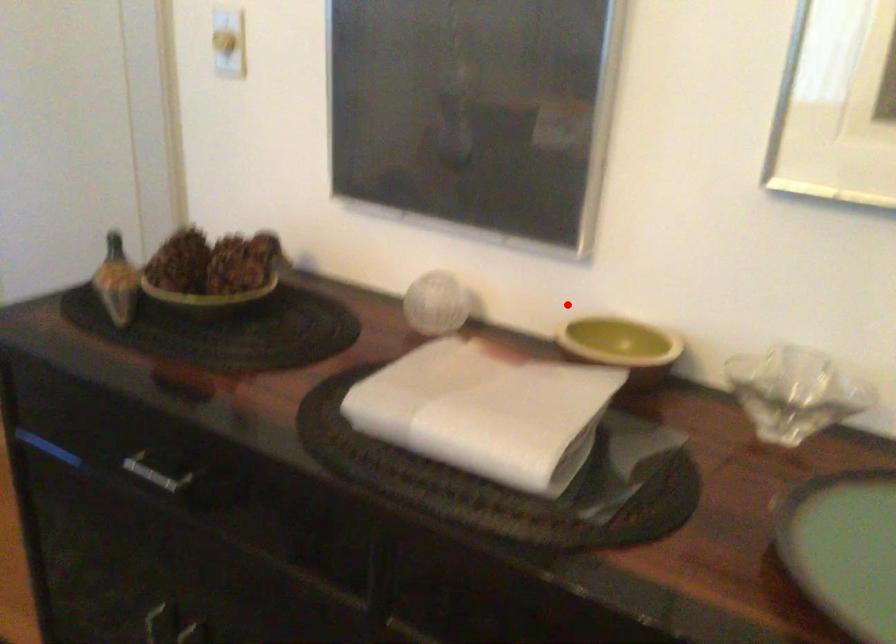
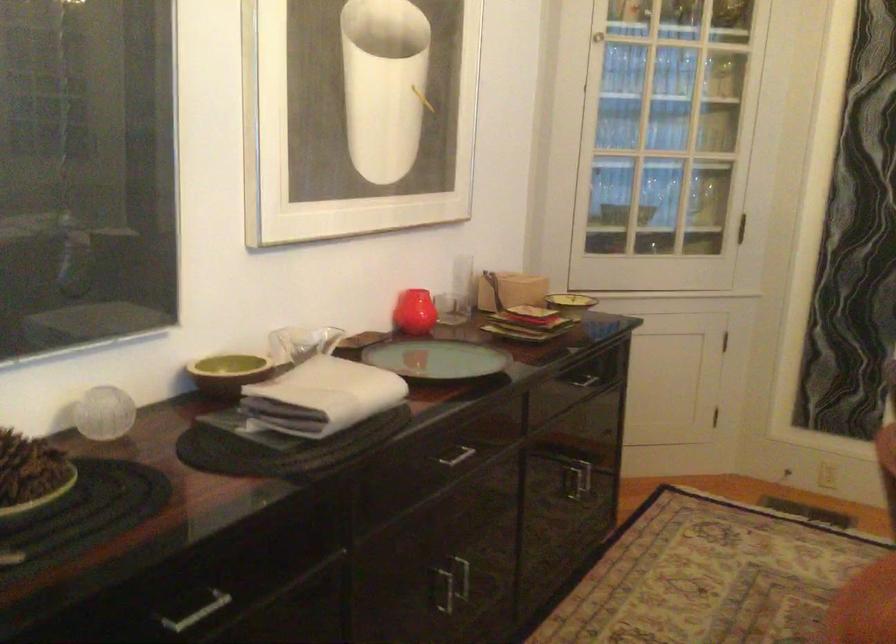
Where in the second image is the point corresponding to the highlighted location from the first image?

(228, 373)